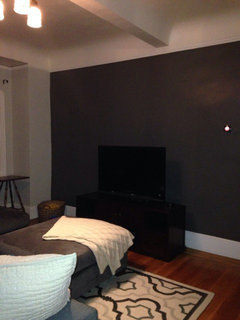
Find the location of `wood floor`. wood floor is located at coordinates (190, 281), (213, 283), (177, 267), (226, 310).